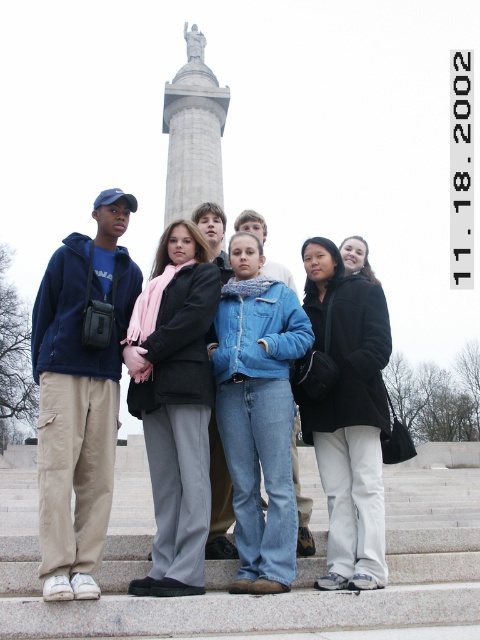
Who is taller, black wool coat at center or black matte jacket at center?

With more height is black matte jacket at center.

Does black wool coat at center appear under black matte jacket at center?

Yes.

Who is more forward, (327, 429) or (182, 540)?

Positioned in front is point (182, 540).

Locate an element on the screen. black wool coat at center is located at coordinates (346, 412).

Which is more to the left, black matte jacket at center or gray stone column at center?

From the viewer's perspective, gray stone column at center appears more on the left side.

Does black matte jacket at center lie in front of gray stone column at center?

Yes, it is in front of gray stone column at center.

Which is behind, point (154, 385) or point (183, 163)?

The point (183, 163) is behind.

At what (x,y) coordinates should I click in order to perform the action: click on black matte jacket at center. Please return your answer as a coordinate pair (x, y). The width and height of the screenshot is (480, 640). Looking at the image, I should click on (176, 406).

Does black wool coat at center have a greater height compared to matte black jacket at center?

Correct, black wool coat at center is much taller as matte black jacket at center.

What do you see at coordinates (346, 412) in the screenshot? The height and width of the screenshot is (640, 480). I see `black wool coat at center` at bounding box center [346, 412].

Locate an element on the screen. This screenshot has width=480, height=640. black wool coat at center is located at coordinates (346, 412).

The height and width of the screenshot is (640, 480). In order to click on black wool coat at center in this screenshot , I will do `click(346, 412)`.